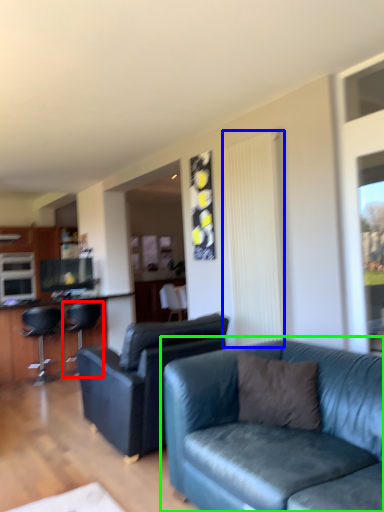
Question: Considering the real-world distances, which object is closest to chair (highlighted by a red box)? curtain (highlighted by a blue box) or studio couch (highlighted by a green box).

Choices:
 (A) curtain
 (B) studio couch

Answer: (A)